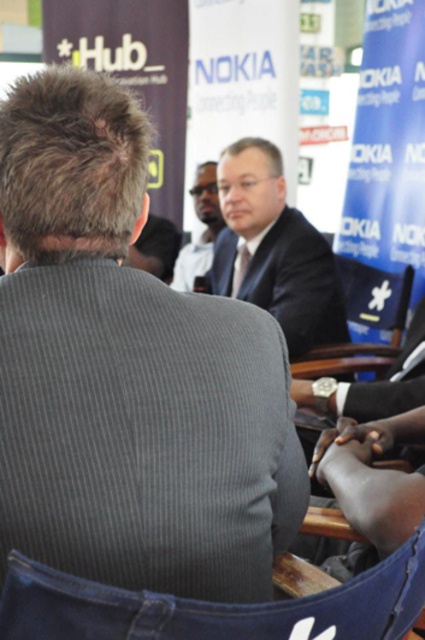
You are attending a networking event and want to approach the dark suit at center and the smooth skin face at center. Which one should you approach first if you want to greet someone who is closer to you?

The dark suit at center is bigger than smooth skin face at center, so you should approach the dark suit at center first since it is closer to you.

You are standing at the entrance of the event venue and want to take a photo that includes both the point at coordinates point (305,307) and point (198,198). Considering their positions, which point should you focus on first to ensure both are in frame?

Since point (305,307) is closer to the viewer than point (198,198), you should focus on point (305,307) first to ensure both are in frame.

You are standing at the entrance of the event venue and want to approach the person in the dark suit at center. Based on their position coordinates, can you estimate how far they are from the entrance?

The dark suit at center is located at coordinates point (272, 250), but without knowing the scale or distance units, it is impossible to determine the exact distance from the entrance.